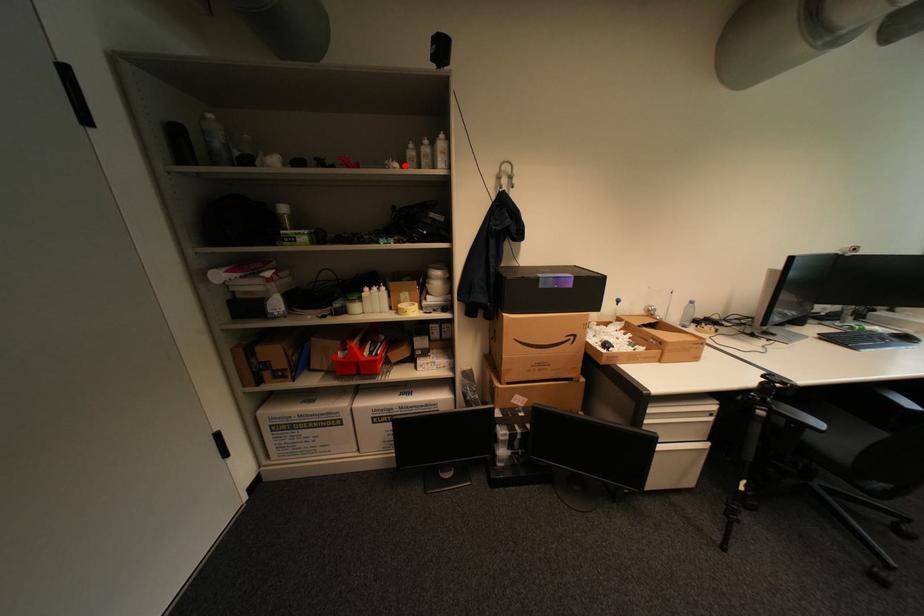
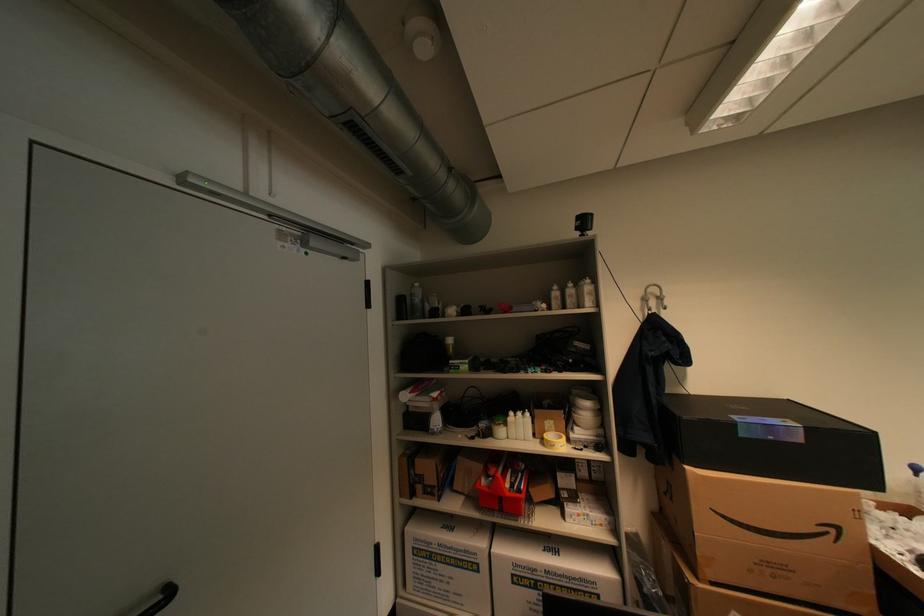
In the second image, find the point that corresponds to the highlighted location in the first image.

(553, 306)